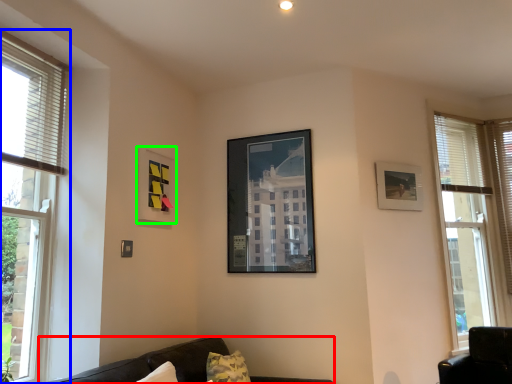
Question: Which is farther away from studio couch (highlighted by a red box)? window (highlighted by a blue box) or picture frame (highlighted by a green box)?

Choices:
 (A) window
 (B) picture frame

Answer: (B)